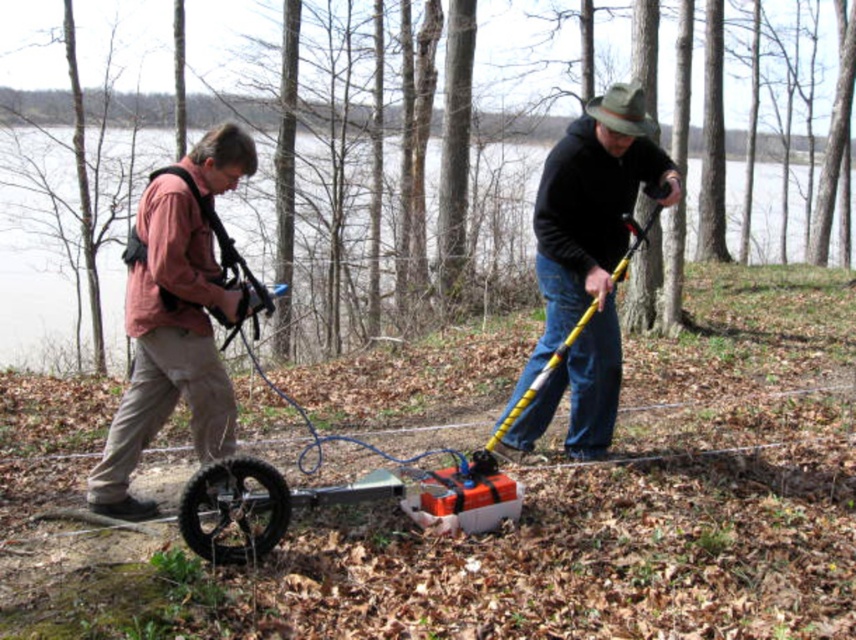
Question: Which point is farther from the camera taking this photo?

Choices:
 (A) (575, 170)
 (B) (120, 470)

Answer: (A)

Question: Among these points, which one is nearest to the camera?

Choices:
 (A) (562, 140)
 (B) (171, 396)

Answer: (B)

Question: Does matte pink shirt at center appear over black matte pole at center?

Choices:
 (A) yes
 (B) no

Answer: (B)

Question: Does matte pink shirt at center have a smaller size compared to black matte pole at center?

Choices:
 (A) yes
 (B) no

Answer: (A)

Question: Is matte pink shirt at center to the left of black matte pole at center from the viewer's perspective?

Choices:
 (A) no
 (B) yes

Answer: (B)